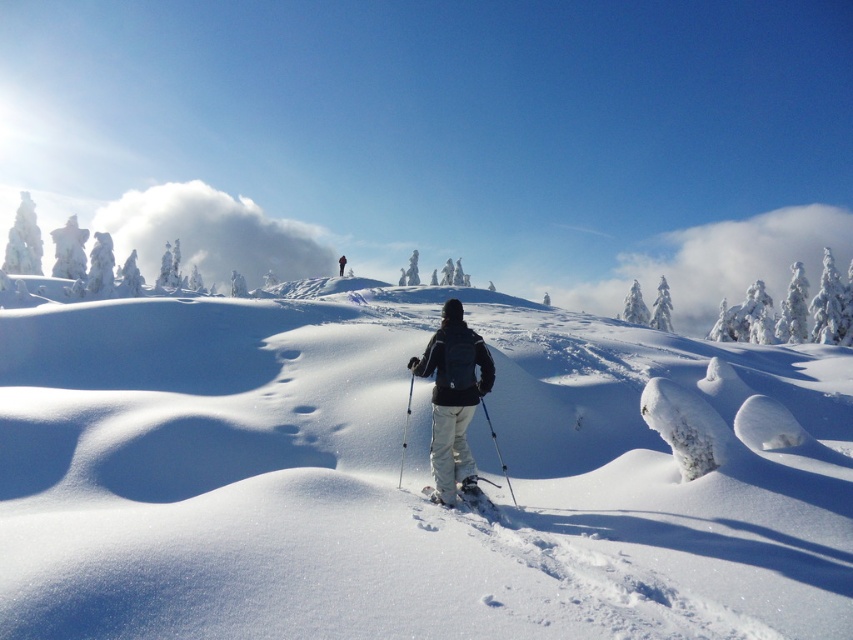
Question: Is metallic silver ski pole at center thinner than black fabric jacket at center?

Choices:
 (A) yes
 (B) no

Answer: (A)

Question: Among these points, which one is nearest to the camera?

Choices:
 (A) (514, 404)
 (B) (491, 429)
 (C) (485, 360)

Answer: (C)

Question: Does matte black jacket at center come in front of metallic silver ski pole at center?

Choices:
 (A) no
 (B) yes

Answer: (B)

Question: Among these points, which one is nearest to the camera?

Choices:
 (A) 343,257
 (B) 509,490

Answer: (B)

Question: Does matte black jacket at center appear on the right side of translucent blue ski pole at center?

Choices:
 (A) yes
 (B) no

Answer: (A)

Question: Which object is farther from the camera taking this photo?

Choices:
 (A) black fabric jacket at center
 (B) matte black jacket at center
 (C) translucent blue ski pole at center

Answer: (A)